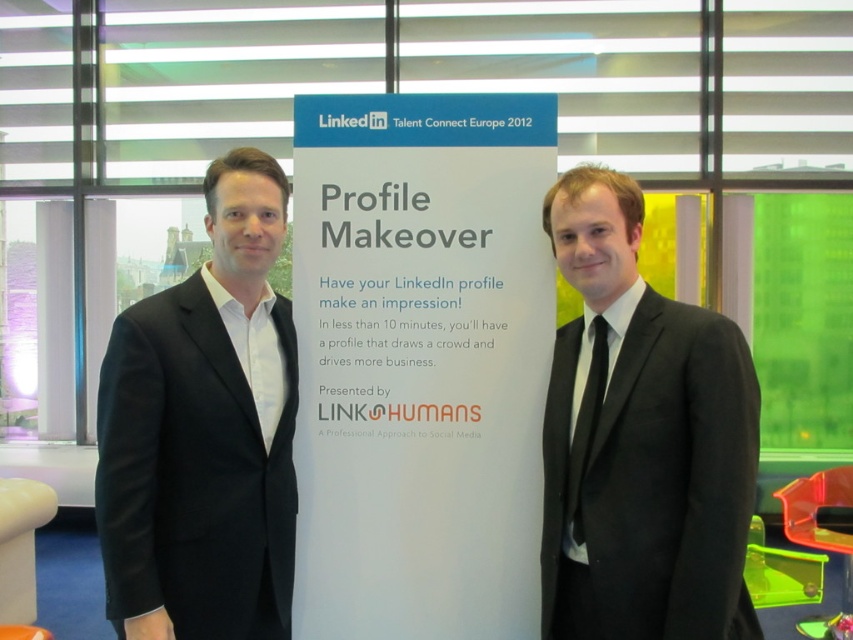
In the scene shown: Can you confirm if black matte suit at right is positioned to the left of black matte suit at left?

No, black matte suit at right is not to the left of black matte suit at left.

Is point (579, 586) in front of point (241, 572)?

No, it is not.

Image resolution: width=853 pixels, height=640 pixels. Find the location of `black matte suit at right`. black matte suit at right is located at coordinates (640, 440).

At what (x,y) coordinates should I click in order to perform the action: click on black matte suit at right. Please return your answer as a coordinate pair (x, y). Looking at the image, I should click on (640, 440).

Which of these two, white paper at center or black matte suit at right, stands shorter?

black matte suit at right

How much distance is there between white paper at center and black matte suit at right?

They are 14.24 inches apart.

Who is more distant from viewer, (357, 355) or (674, 448)?

Point (357, 355)

Identify the location of white paper at center. The image size is (853, 640). pyautogui.click(x=421, y=362).

Is white paper at center shorter than black matte suit at left?

In fact, white paper at center may be taller than black matte suit at left.

Does white paper at center have a larger size compared to black matte suit at left?

Actually, white paper at center might be smaller than black matte suit at left.

Is point (500, 93) in front of point (247, 282)?

No, it is not.

I want to click on white paper at center, so (421, 362).